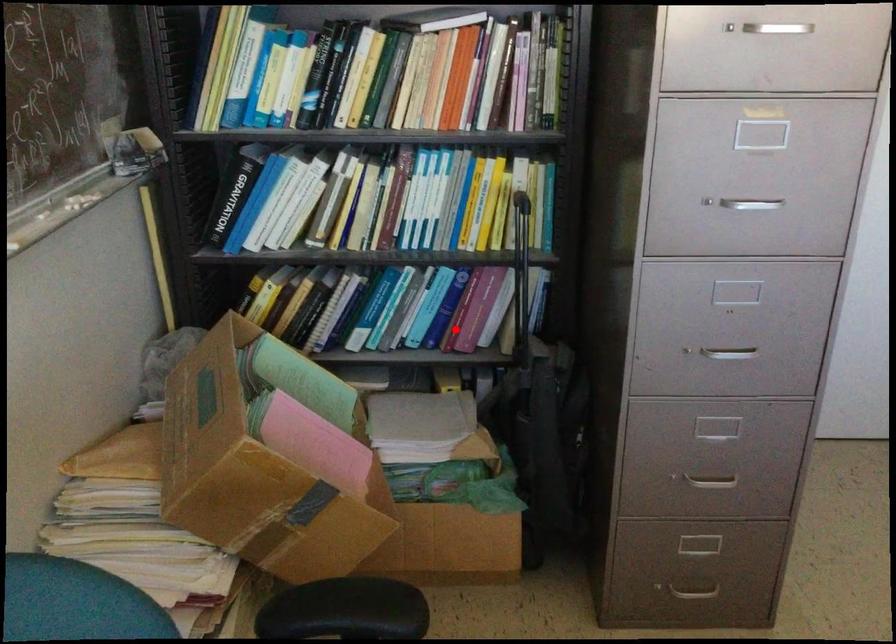
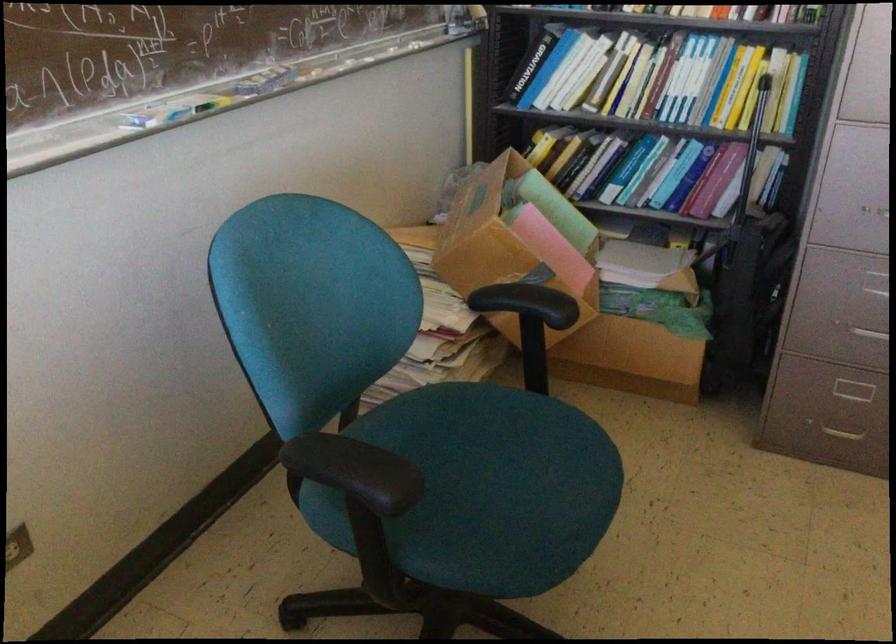
Question: A red point is marked in image1. In image2, is the corresponding 3D point closer to the camera or farther? Reply with the corresponding letter.

Choices:
 (A) The corresponding 3D point is closer.
 (B) The corresponding 3D point is farther.

Answer: (B)